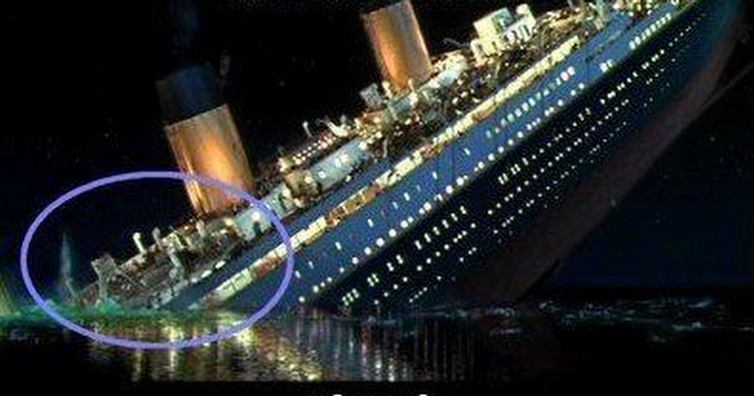
Identify the location of lights. The height and width of the screenshot is (396, 754). (206, 274), (221, 260), (339, 158), (335, 163), (515, 88), (562, 45).